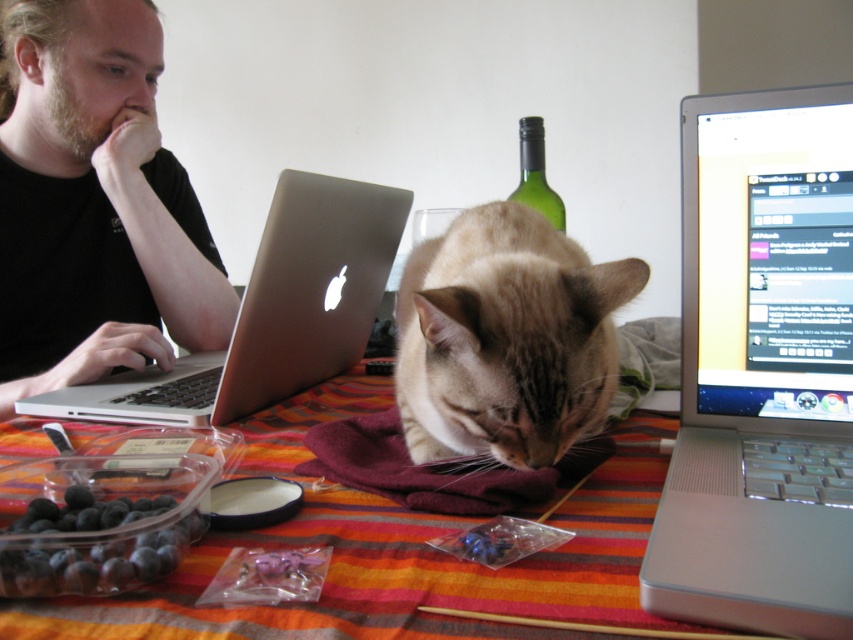
Who is lower down, striped fabric tablecloth at center or green glass bottle at upper center?

striped fabric tablecloth at center is below.

Is point (189, 611) positioned in front of point (548, 193)?

Yes.

The width and height of the screenshot is (853, 640). I want to click on striped fabric tablecloth at center, so click(398, 573).

Can you confirm if dark blue glossy berries at lower left is thinner than green glass bottle at upper center?

Incorrect, dark blue glossy berries at lower left's width is not less than green glass bottle at upper center's.

Does dark blue glossy berries at lower left have a smaller size compared to green glass bottle at upper center?

Yes.

Is point (57, 508) in front of point (544, 192)?

Yes, it is.

The height and width of the screenshot is (640, 853). Find the location of `dark blue glossy berries at lower left`. dark blue glossy berries at lower left is located at coordinates (96, 544).

Consider the image. Measure the distance between point (341,266) and camera.

31.84 inches

Is satin gold laptop at left thinner than dark blue glossy berries at lower left?

Incorrect, satin gold laptop at left's width is not less than dark blue glossy berries at lower left's.

The width and height of the screenshot is (853, 640). Describe the element at coordinates (270, 314) in the screenshot. I see `satin gold laptop at left` at that location.

The width and height of the screenshot is (853, 640). I want to click on satin gold laptop at left, so click(x=270, y=314).